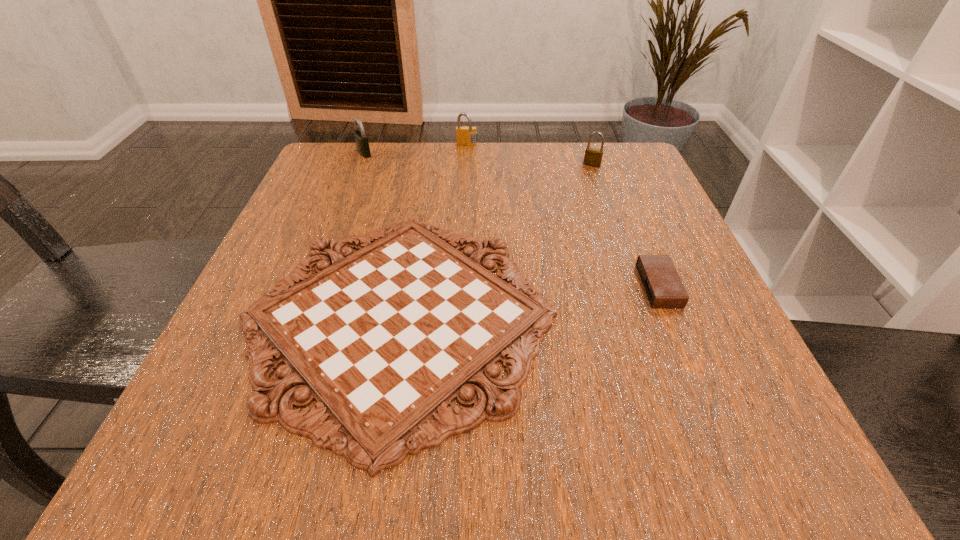
Identify the location of the second padlock from left to right. The width and height of the screenshot is (960, 540). (465, 136).

This screenshot has width=960, height=540. Identify the location of the leftmost padlock. (361, 139).

The width and height of the screenshot is (960, 540). Identify the location of the rightmost padlock. (593, 157).

Find the location of `the third nearest object`. the third nearest object is located at coordinates (593, 157).

Image resolution: width=960 pixels, height=540 pixels. In order to click on alarm clock in this screenshot , I will do `click(663, 286)`.

Find the location of `chessboard`. chessboard is located at coordinates (384, 339).

Image resolution: width=960 pixels, height=540 pixels. Find the location of `free space located on the side with the combination dials of the second padlock from right to left`. free space located on the side with the combination dials of the second padlock from right to left is located at coordinates (467, 164).

This screenshot has width=960, height=540. I want to click on vacant space located 0.170m on the front of the leftmost padlock, so click(x=347, y=199).

Where is `free point located 0.110m on the left of the rightmost padlock`? The width and height of the screenshot is (960, 540). free point located 0.110m on the left of the rightmost padlock is located at coordinates (536, 165).

Locate an element on the screen. blank area located on the front face of the alarm clock is located at coordinates (546, 286).